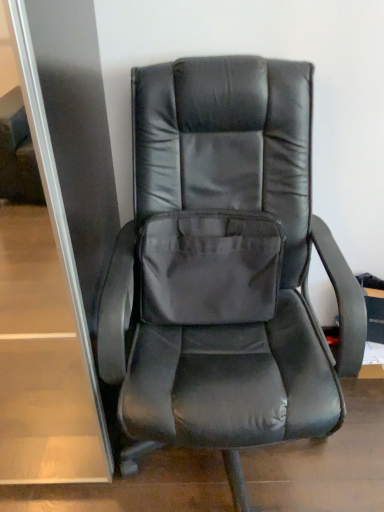
What do you see at coordinates (209, 267) in the screenshot? Image resolution: width=384 pixels, height=512 pixels. I see `gray fabric pocket at center` at bounding box center [209, 267].

Where is `gray fabric pocket at center`? This screenshot has height=512, width=384. gray fabric pocket at center is located at coordinates (209, 267).

Measure the distance between point (116,368) and camera.

Point (116,368) is 3.36 feet from camera.

Where is `matte black chair at center`? matte black chair at center is located at coordinates (224, 266).

What do you see at coordinates (224, 266) in the screenshot?
I see `matte black chair at center` at bounding box center [224, 266].

This screenshot has height=512, width=384. In order to click on gray fabric pocket at center in this screenshot , I will do `click(209, 267)`.

Considering the relative positions of gray fabric pocket at center and matte black chair at center in the image provided, is gray fabric pocket at center to the left of matte black chair at center from the viewer's perspective?

Indeed, gray fabric pocket at center is positioned on the left side of matte black chair at center.

Is the depth of gray fabric pocket at center greater than that of matte black chair at center?

Yes, gray fabric pocket at center is further from the camera.

Does point (228, 318) lie behind point (159, 126)?

Yes, it is.

From the image's perspective, is gray fabric pocket at center on matte black chair at center?

Yes, from the image's perspective, gray fabric pocket at center is over matte black chair at center.

From a real-world perspective, is gray fabric pocket at center on top of matte black chair at center?

Yes, from a real-world perspective, gray fabric pocket at center is on top of matte black chair at center.

Is gray fabric pocket at center thinner than matte black chair at center?

Yes, gray fabric pocket at center is thinner than matte black chair at center.

Is gray fabric pocket at center taller than matte black chair at center?

No.

Is gray fabric pocket at center smaller than matte black chair at center?

Yes, gray fabric pocket at center is smaller than matte black chair at center.

From the picture: Is gray fabric pocket at center outside of matte black chair at center?

Actually, gray fabric pocket at center is at least partially inside matte black chair at center.

Is gray fabric pocket at center placed right next to matte black chair at center?

Yes, gray fabric pocket at center is right next to matte black chair at center and making contact.

Is gray fabric pocket at center positioned with its back to matte black chair at center?

Yes, gray fabric pocket at center's orientation is away from matte black chair at center.

Can you tell me how much gray fabric pocket at center and matte black chair at center differ in facing direction?

0.00135 degrees separate the facing orientations of gray fabric pocket at center and matte black chair at center.

Measure the distance from gray fabric pocket at center to matte black chair at center.

The distance of gray fabric pocket at center from matte black chair at center is 3.70 inches.

Where is `pocket behind the matte black chair at center`? pocket behind the matte black chair at center is located at coordinates [209, 267].

Does matte black chair at center appear on the left side of gray fabric pocket at center?

Incorrect, matte black chair at center is not on the left side of gray fabric pocket at center.

Which object is more forward, matte black chair at center or gray fabric pocket at center?

matte black chair at center.

Does point (242, 283) come in front of point (142, 317)?

No, it is behind (142, 317).

From the image's perspective, is matte black chair at center on top of gray fabric pocket at center?

Actually, matte black chair at center appears below gray fabric pocket at center in the image.

From a real-world perspective, which is physically below, matte black chair at center or gray fabric pocket at center?

matte black chair at center.

Does matte black chair at center have a greater width compared to gray fabric pocket at center?

Correct, the width of matte black chair at center exceeds that of gray fabric pocket at center.

Considering the sizes of objects matte black chair at center and gray fabric pocket at center in the image provided, who is shorter, matte black chair at center or gray fabric pocket at center?

With less height is gray fabric pocket at center.

From the picture: Between matte black chair at center and gray fabric pocket at center, which one has larger size?

matte black chair at center.

Would you say matte black chair at center is inside or outside gray fabric pocket at center?

matte black chair at center is spatially situated outside gray fabric pocket at center.

Would you say matte black chair at center is a long distance from gray fabric pocket at center?

They are positioned close to each other.

Is matte black chair at center turned away from gray fabric pocket at center?

Yes, matte black chair at center is positioned with its back facing gray fabric pocket at center.

What's the angular difference between matte black chair at center and gray fabric pocket at center's facing directions?

The angular difference between matte black chair at center and gray fabric pocket at center is 0.00135 degrees.

Measure the distance between matte black chair at center and gray fabric pocket at center.

They are 3.70 inches apart.

Where is `pocket above the matte black chair at center (from a real-world perspective)`? pocket above the matte black chair at center (from a real-world perspective) is located at coordinates (209, 267).

Find the location of a particular element. pocket on the left of matte black chair at center is located at coordinates (209, 267).

Identify the location of chair on the right of gray fabric pocket at center. This screenshot has height=512, width=384. (224, 266).